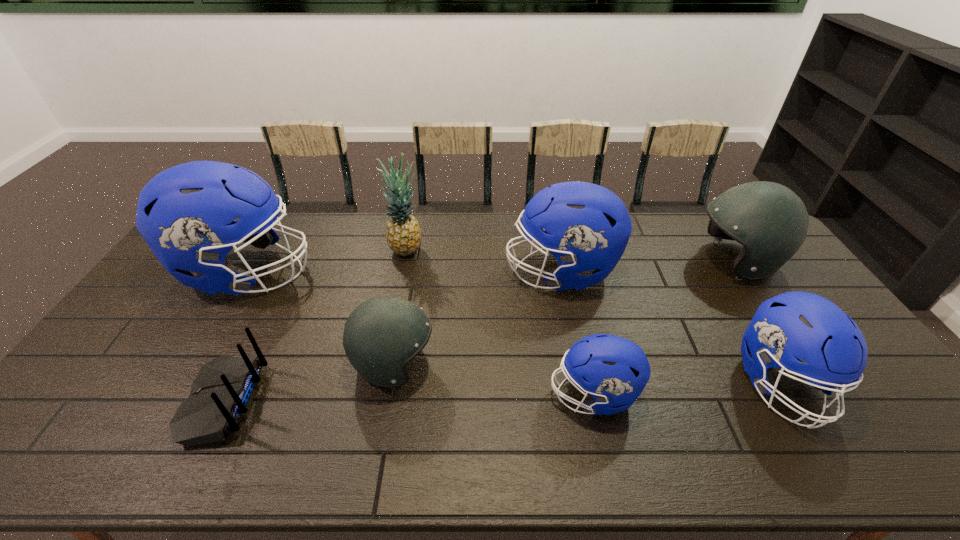
The image size is (960, 540). In order to click on vacant area between the second biggest blue football helmet and the smallest blue football helmet in this screenshot , I will do `click(577, 333)`.

Locate an element on the screen. empty space between the router and the bigger green football helmet is located at coordinates (480, 331).

You are a GUI agent. You are given a task and a screenshot of the screen. Output one action in this format:
    pyautogui.click(x=<x>, y=<y>)
    Task: Click on the free area in between the black router and the smallest blue football helmet
    The width and height of the screenshot is (960, 540).
    Given the screenshot: What is the action you would take?
    pyautogui.click(x=409, y=397)

Find the location of a particular element. Image resolution: width=960 pixels, height=540 pixels. vacant space in between the nearer green football helmet and the black router is located at coordinates click(309, 382).

The width and height of the screenshot is (960, 540). Identify the location of unoccupied position between the leftmost blue football helmet and the rightmost blue football helmet. (514, 328).

Identify the location of the fourth closest object to the smallest blue football helmet. (771, 222).

The height and width of the screenshot is (540, 960). Find the location of `the fifth closest object to the router`. the fifth closest object to the router is located at coordinates point(613,370).

The image size is (960, 540). I want to click on football helmet that is the fourth closest to the yellow pineapple, so click(613, 370).

Identify the location of football helmet identified as the fourth closest to the smaller green football helmet. (795, 325).

Select which blue football helmet appears as the fourth closest to the farther green football helmet. Please provide its 2D coordinates. Your answer should be formatted as a tuple, i.e. [(x, y)], where the tuple contains the x and y coordinates of a point satisfying the conditions above.

[(185, 214)]